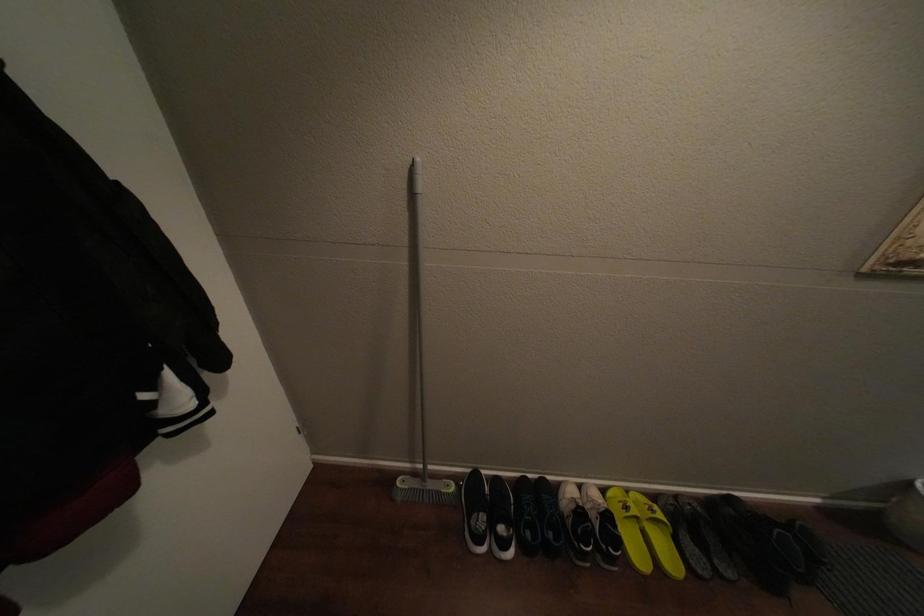
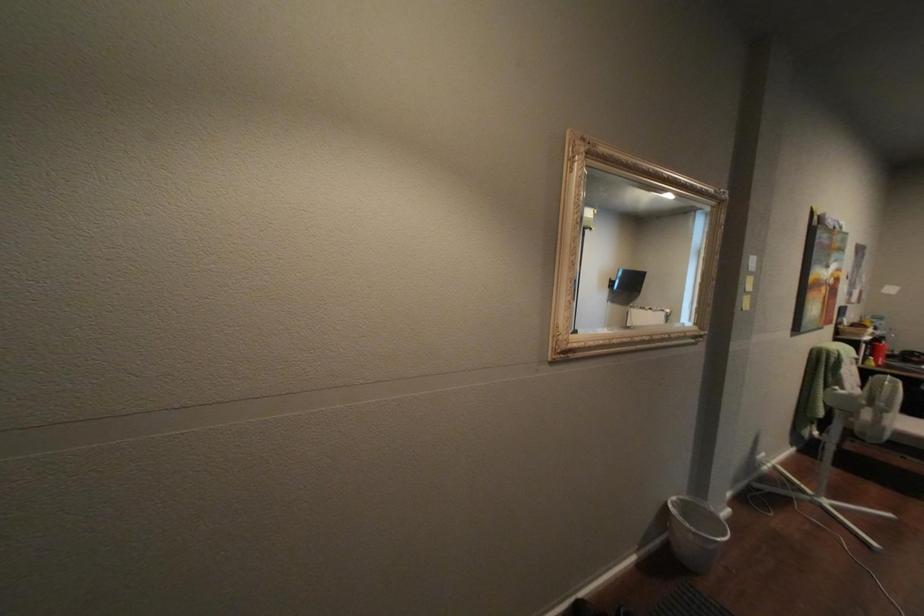
The images are taken continuously from a first-person perspective. In which direction is your viewpoint rotating?

The camera's rotation is toward right-up.